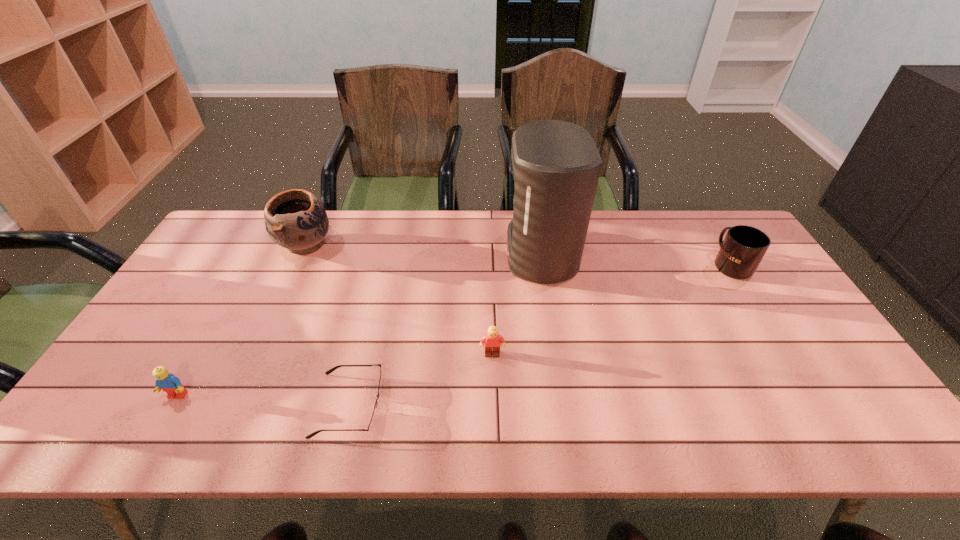
You are a GUI agent. You are given a task and a screenshot of the screen. Output one action in this format:
    pyautogui.click(x=<x>, y=<y>)
    Task: Click on the fourth object from right to left
    
    Given the screenshot: What is the action you would take?
    pyautogui.click(x=372, y=423)

This screenshot has width=960, height=540. What are the coordinates of `spectacles` in the screenshot? It's located at (372, 423).

Locate an element on the screen. The height and width of the screenshot is (540, 960). vacant space located 0.060m on the button side of the second object from right to left is located at coordinates (487, 254).

At what (x,y) coordinates should I click in order to perform the action: click on free space located 0.220m on the button side of the second object from right to left. Please return your answer as a coordinate pair (x, y). Looking at the image, I should click on (437, 254).

Where is `free space located 0.280m on the button side of the second object from right to left`? This screenshot has height=540, width=960. free space located 0.280m on the button side of the second object from right to left is located at coordinates (419, 254).

Where is `vacant space positioned on the right of the second object from left to right`? vacant space positioned on the right of the second object from left to right is located at coordinates (426, 244).

Identify the location of vacant space located 0.150m with the handle on the side of the mug. (705, 222).

Where is `free space located with the handle on the side of the mug`? The width and height of the screenshot is (960, 540). free space located with the handle on the side of the mug is located at coordinates (701, 217).

The width and height of the screenshot is (960, 540). I want to click on vacant area situated 0.060m with the handle on the side of the mug, so click(x=714, y=238).

This screenshot has height=540, width=960. I want to click on free location located 0.110m on the face of the farther Lego, so (x=493, y=396).